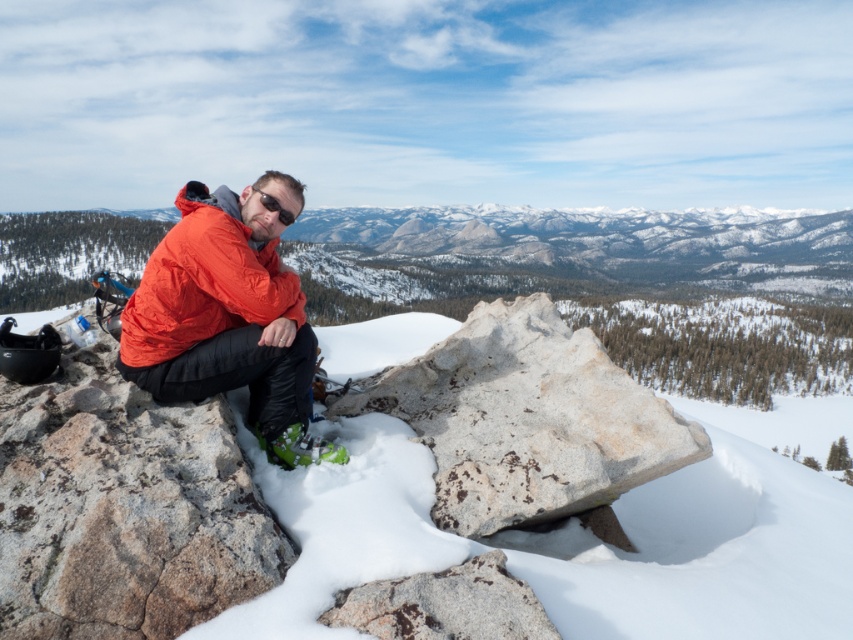
You are a photographer trying to capture the person in the image. You want to ensure that both the white powdery snow at center and the black matte sunglasses at center are clearly visible in your shot. Which object should you focus on first to ensure depth of field captures both?

The white powdery snow at center is below the black matte sunglasses at center. To ensure both are in focus, focus on the black matte sunglasses at center first since it is closer to the camera, allowing the snow behind it to remain sharp within the depth of field.

You are a photographer trying to capture the person in the snowy mountain landscape. You want to ensure both the matte orange jacket at center and the black matte sunglasses at center are clearly visible in your shot. Based on their sizes, which object should you focus on to ensure both are in frame?

The matte orange jacket at center might be wider than black matte sunglasses at center, so focusing on the matte orange jacket at center would ensure both are in frame since it is likely larger and occupies more space.

You are a photographer aiming to capture the person in the image while ensuring both the white powdery snow at center and the black matte sunglasses at center are clearly visible. Which object should you focus on first to ensure proper exposure, considering their positions?

The white powdery snow at center is positioned on the right side of black matte sunglasses at center. To ensure proper exposure, focus on the white powdery snow at center first since it is brighter and will help balance the exposure for both objects.